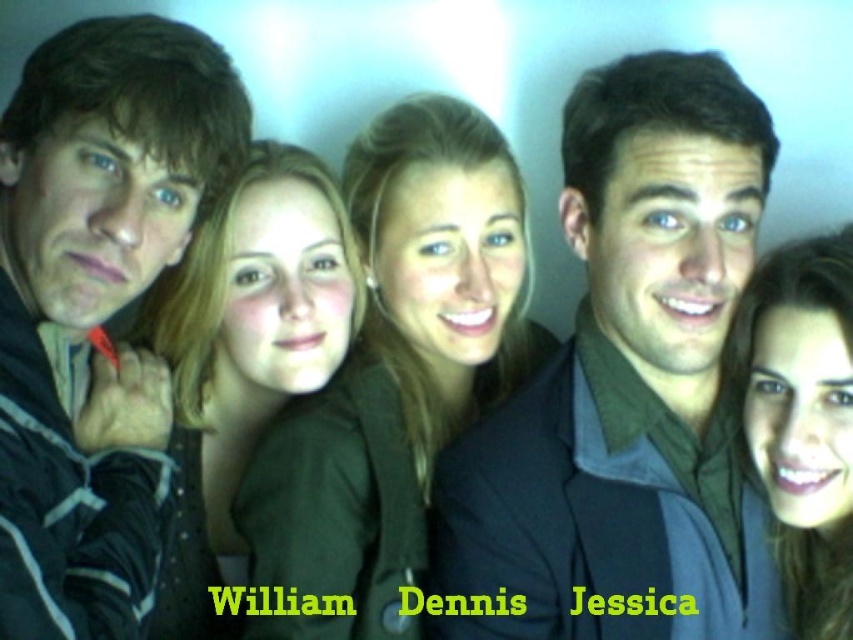
Looking at this image, you are standing in front of the group photo and want to identify the person wearing the smooth black shirt at center. Which direction should you look relative to the dark gray jacket at left?

The smooth black shirt at center is to the right of the dark gray jacket at left, so you should look to the right of the dark gray jacket at left to find the person wearing the smooth black shirt at center.

You are standing at the point marked at coordinates (548, 353) and want to move towards the nearest person in the group. Which direction should you move to reach them?

The nearest person to the point marked at coordinates (548, 353) is 1.59 meters away. Since the point is at coordinates (548, 353), you should move towards the direction where the nearest person is located, which is not specified in the scene description. However, based on the distance provided, moving towards the nearest person would be the correct direction.

Based on the scene description, where is the smooth black jacket at center located in the image?

The smooth black jacket at center is located at point coordinates of 0.580 on the x axis and 0.465 on the y axis.